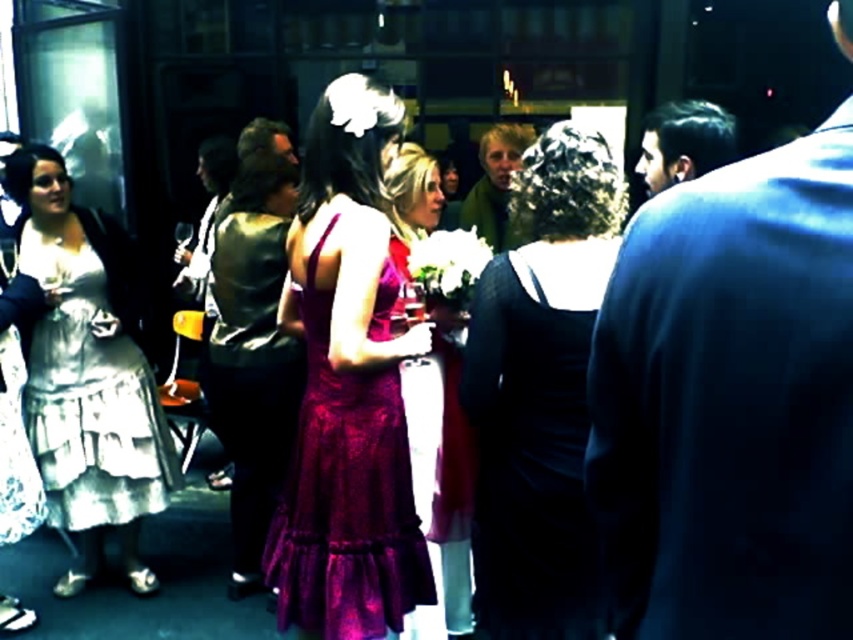
Question: Which of the following is the farthest from the observer?

Choices:
 (A) white lace dress at left
 (B) purple lace dress at center

Answer: (A)

Question: Among these points, which one is nearest to the camera?

Choices:
 (A) (486, 148)
 (B) (660, 108)
 (C) (457, 586)
 (D) (393, 460)

Answer: (D)

Question: Does dark blue suit at right have a greater width compared to dark brown hair at upper right?

Choices:
 (A) no
 (B) yes

Answer: (A)

Question: Observing the image, what is the correct spatial positioning of purple lace dress at center in reference to green fuzzy sweater at center?

Choices:
 (A) left
 (B) right

Answer: (A)

Question: Which point is closer to the camera taking this photo?

Choices:
 (A) pos(102,474)
 (B) pos(500,138)
 (C) pos(561,355)

Answer: (C)

Question: Does purple lace dress at center have a lesser width compared to green fuzzy sweater at center?

Choices:
 (A) no
 (B) yes

Answer: (B)